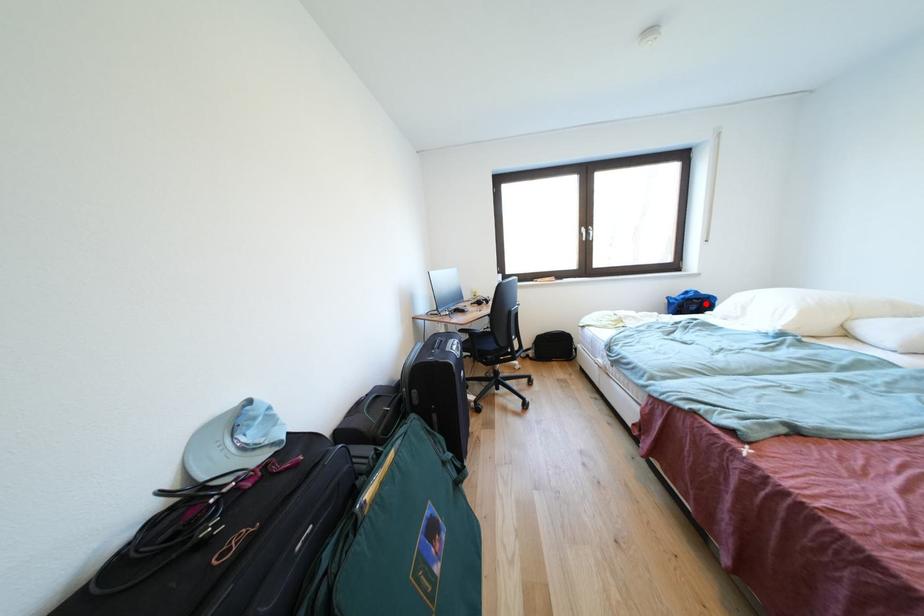
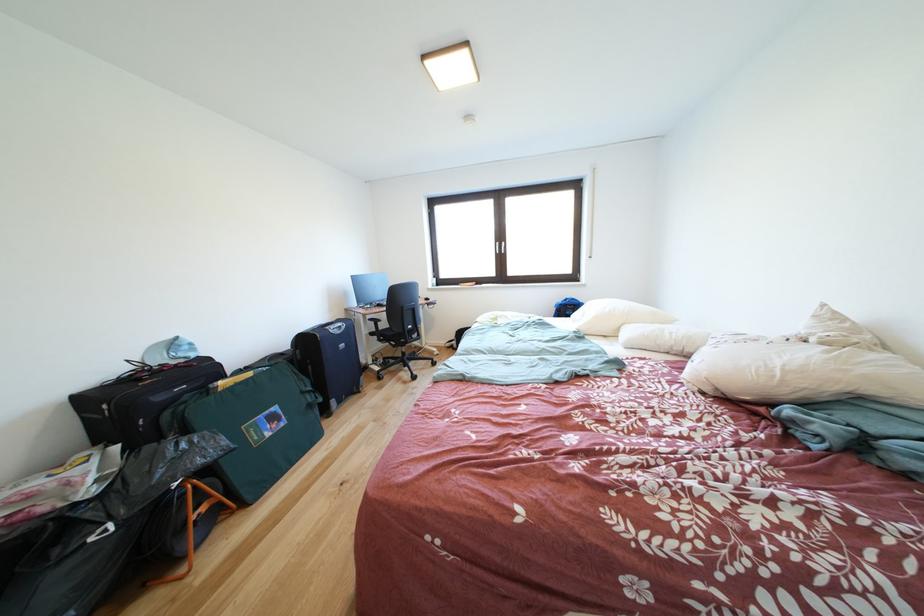
Question: I am providing you with two images of the same scene from different viewpoints. In image1, a red point is highlighted. Considering the same 3D point in image2, which of the following is correct?

Choices:
 (A) It is closer
 (B) It is farther

Answer: (B)